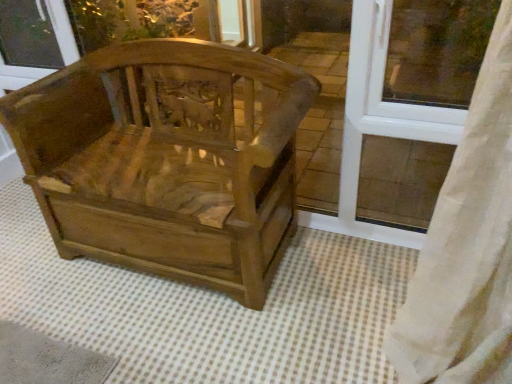
Question: Is wooden carved chair at center closer to camera compared to transparent glass window screen at upper left?

Choices:
 (A) no
 (B) yes

Answer: (B)

Question: Does wooden carved chair at center have a larger size compared to transparent glass window screen at upper left?

Choices:
 (A) no
 (B) yes

Answer: (B)

Question: Considering the relative positions of wooden carved chair at center and transparent glass window screen at upper left in the image provided, is wooden carved chair at center to the right of transparent glass window screen at upper left from the viewer's perspective?

Choices:
 (A) yes
 (B) no

Answer: (A)

Question: Can you confirm if wooden carved chair at center is wider than transparent glass window screen at upper left?

Choices:
 (A) no
 (B) yes

Answer: (B)

Question: Considering the relative sizes of wooden carved chair at center and transparent glass window screen at upper left in the image provided, is wooden carved chair at center shorter than transparent glass window screen at upper left?

Choices:
 (A) yes
 (B) no

Answer: (B)

Question: In the image, is wooden carved chair at center positioned in front of or behind transparent glass window screen at upper left?

Choices:
 (A) behind
 (B) front

Answer: (B)

Question: Is wooden carved chair at center taller or shorter than transparent glass window screen at upper left?

Choices:
 (A) tall
 (B) short

Answer: (A)

Question: In terms of size, does wooden carved chair at center appear bigger or smaller than transparent glass window screen at upper left?

Choices:
 (A) small
 (B) big

Answer: (B)

Question: From the image's perspective, is wooden carved chair at center above or below transparent glass window screen at upper left?

Choices:
 (A) above
 (B) below

Answer: (B)

Question: Does point (356, 66) appear closer or farther from the camera than point (226, 69)?

Choices:
 (A) farther
 (B) closer

Answer: (B)

Question: Looking at the image, does white plastic window frame at upper right seem bigger or smaller compared to wooden carved chair at center?

Choices:
 (A) small
 (B) big

Answer: (A)

Question: Based on their positions, is white plastic window frame at upper right located to the left or right of wooden carved chair at center?

Choices:
 (A) right
 (B) left

Answer: (A)

Question: Relative to wooden carved chair at center, is white plastic window frame at upper right in front or behind?

Choices:
 (A) front
 (B) behind

Answer: (B)

Question: Considering the positions of transparent glass window screen at upper left and wooden carved chair at center in the image, is transparent glass window screen at upper left taller or shorter than wooden carved chair at center?

Choices:
 (A) tall
 (B) short

Answer: (B)

Question: Is point (56, 44) closer or farther from the camera than point (145, 251)?

Choices:
 (A) closer
 (B) farther

Answer: (B)